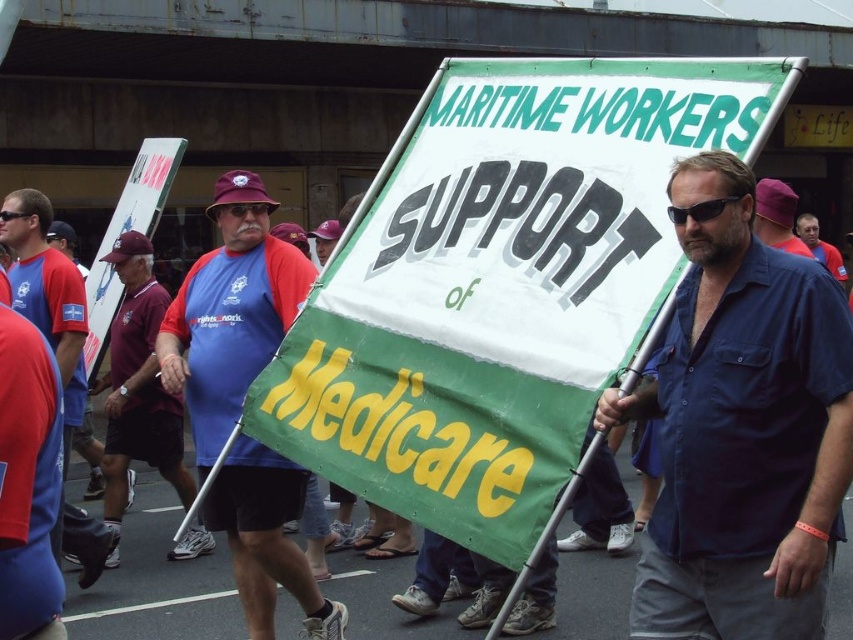
Where is `blue fabric shirt at center`? The height and width of the screenshot is (640, 853). blue fabric shirt at center is located at coordinates (230, 312).

Where is `blue fabric shirt at center`? The width and height of the screenshot is (853, 640). blue fabric shirt at center is located at coordinates (230, 312).

Is red fabric shirt at left behind blue shirt at center?

No, red fabric shirt at left is in front of blue shirt at center.

Image resolution: width=853 pixels, height=640 pixels. Describe the element at coordinates (47, 296) in the screenshot. I see `red fabric shirt at left` at that location.

Measure the distance between point (x=78, y=365) and camera.

They are 5.03 meters apart.

Locate an element on the screen. red fabric shirt at left is located at coordinates click(47, 296).

Which is more to the left, blue cotton shirt at center or purple fabric cap at upper center?

blue cotton shirt at center is more to the left.

Looking at this image, who is more distant from viewer, (747, 426) or (781, 189)?

The point (781, 189) is more distant.

You are a GUI agent. You are given a task and a screenshot of the screen. Output one action in this format:
    pyautogui.click(x=<x>, y=<y>)
    Task: Click on the blue cotton shirt at center
    Image resolution: width=853 pixels, height=640 pixels.
    Given the screenshot: What is the action you would take?
    pyautogui.click(x=741, y=428)